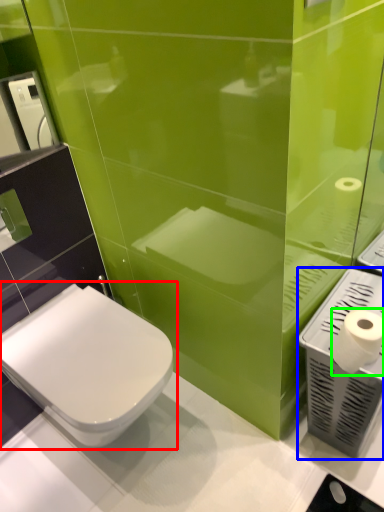
Question: Estimate the real-world distances between objects in this image. Which object is closer to toilet (highlighted by a red box), hand dryer (highlighted by a blue box) or toilet paper (highlighted by a green box)?

Choices:
 (A) hand dryer
 (B) toilet paper

Answer: (A)